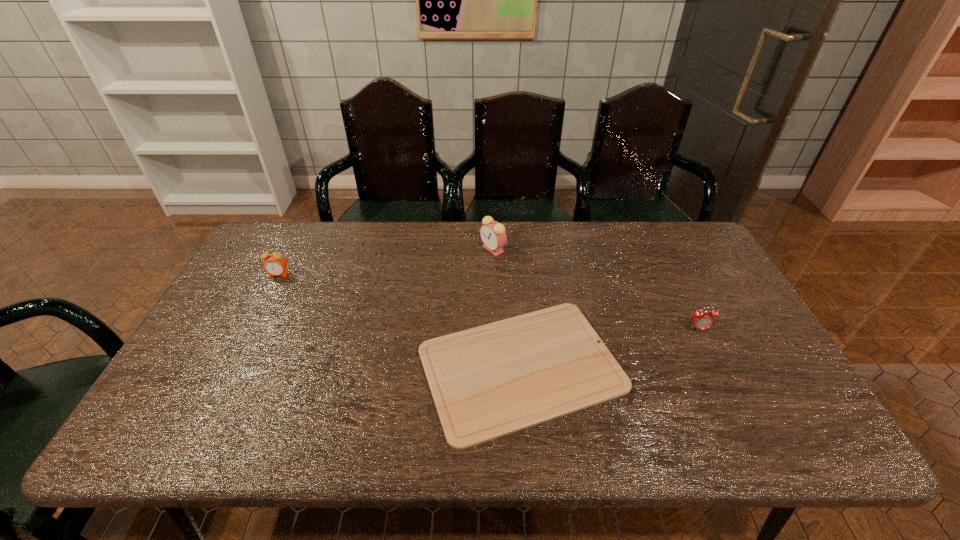
At what (x,y) coordinates should I click in order to perform the action: click on free point located 0.210m on the face of the leftmost object. Please return your answer as a coordinate pair (x, y). The height and width of the screenshot is (540, 960). Looking at the image, I should click on [x=251, y=329].

Where is `vacant space located 0.280m on the face of the rightmost alarm clock`? Image resolution: width=960 pixels, height=540 pixels. vacant space located 0.280m on the face of the rightmost alarm clock is located at coordinates (747, 427).

Locate an element on the screen. The height and width of the screenshot is (540, 960). free region located on the back of the chopping board is located at coordinates (512, 261).

At what (x,y) coordinates should I click in order to perform the action: click on object that is at the far edge. Please return your answer as a coordinate pair (x, y). Looking at the image, I should click on (493, 235).

Locate an element on the screen. object present at the near edge is located at coordinates (490, 381).

You are a GUI agent. You are given a task and a screenshot of the screen. Output one action in this format:
    pyautogui.click(x=<x>, y=<y>)
    Task: Click on the object located at the left edge
    
    Given the screenshot: What is the action you would take?
    pyautogui.click(x=275, y=264)

What are the coordinates of `object positioned at the right edge` in the screenshot? It's located at (702, 320).

In the image, there is a desktop. In order to click on vacant space at the far edge in this screenshot , I will do `click(543, 238)`.

This screenshot has height=540, width=960. I want to click on vacant space at the near edge, so click(x=339, y=448).

Locate an element on the screen. vacant area at the left edge of the desktop is located at coordinates (259, 336).